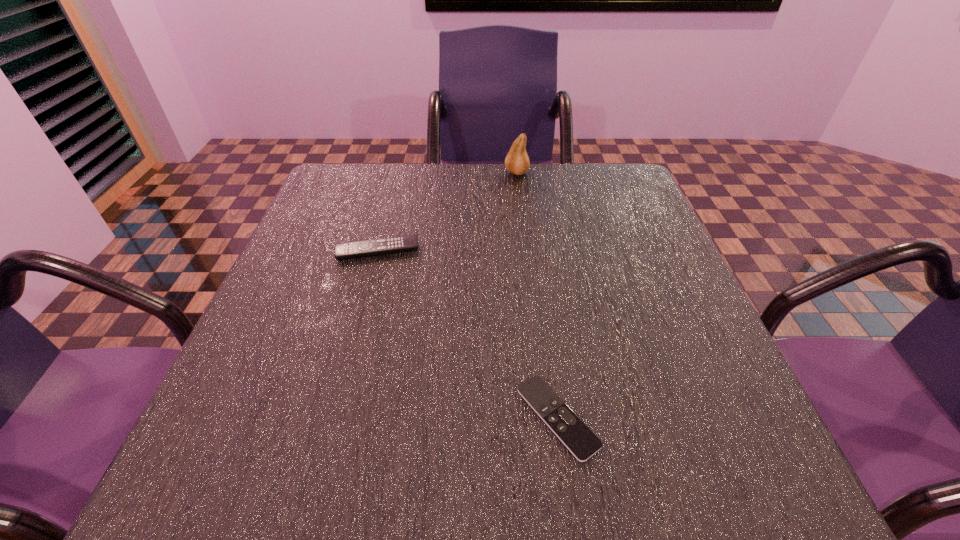
Locate an element on the screen. free space between the taller remote control and the right remote control is located at coordinates (468, 334).

Locate an element on the screen. The image size is (960, 540). vacant region between the left remote control and the shortest object is located at coordinates (468, 334).

Image resolution: width=960 pixels, height=540 pixels. I want to click on free area in between the right remote control and the farther remote control, so click(468, 334).

Where is `free spot between the pear and the shortest object`? Image resolution: width=960 pixels, height=540 pixels. free spot between the pear and the shortest object is located at coordinates 537,295.

What are the coordinates of `unoccupied area between the left remote control and the nearest object` in the screenshot? It's located at (468, 334).

Where is `vacant area between the nearer remote control and the farther remote control`? This screenshot has width=960, height=540. vacant area between the nearer remote control and the farther remote control is located at coordinates (468, 334).

This screenshot has width=960, height=540. In order to click on empty location between the nearer remote control and the pear in this screenshot , I will do `click(537, 295)`.

Locate an element on the screen. The height and width of the screenshot is (540, 960). empty location between the farthest object and the right remote control is located at coordinates (537, 295).

I want to click on the closest object to the farther remote control, so click(x=517, y=162).

Point out which object is positioned as the second nearest to the leftmost object. Please provide its 2D coordinates. Your answer should be formatted as a tuple, i.e. [(x, y)], where the tuple contains the x and y coordinates of a point satisfying the conditions above.

[(566, 425)]